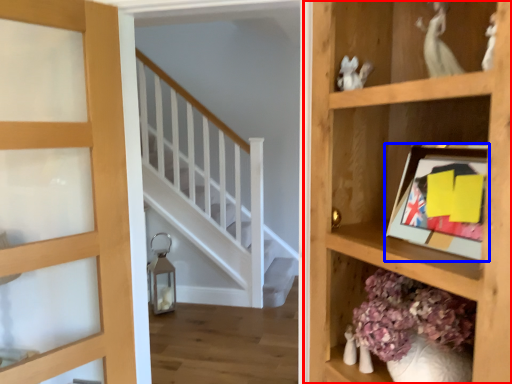
Question: Which of the following is the closest to the observer, shelf (highlighted by a red box) or picture frame (highlighted by a blue box)?

Choices:
 (A) shelf
 (B) picture frame

Answer: (A)